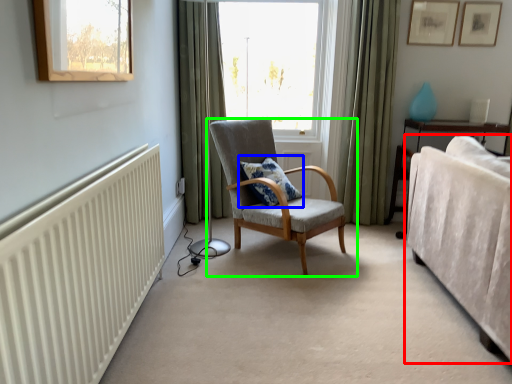
Question: Based on their relative distances, which object is nearer to studio couch (highlighted by a red box)? Choose from pillow (highlighted by a blue box) and chair (highlighted by a green box).

Choices:
 (A) pillow
 (B) chair

Answer: (B)